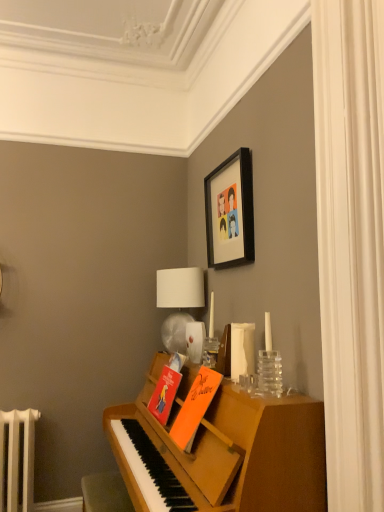
Question: From a real-world perspective, is white fabric lampshade at upper center below matte orange book at center, which is the second book in front-to-back order?

Choices:
 (A) yes
 (B) no

Answer: (B)

Question: Does white fabric lampshade at upper center have a smaller size compared to matte orange book at center, which is the second book in front-to-back order?

Choices:
 (A) yes
 (B) no

Answer: (B)

Question: Does white fabric lampshade at upper center have a lesser height compared to matte orange book at center, which is the second book in front-to-back order?

Choices:
 (A) no
 (B) yes

Answer: (A)

Question: Is white fabric lampshade at upper center not near matte orange book at center, acting as the first book starting from the back?

Choices:
 (A) no
 (B) yes

Answer: (A)

Question: Are white fabric lampshade at upper center and matte orange book at center, which is the second book in front-to-back order, making contact?

Choices:
 (A) yes
 (B) no

Answer: (B)

Question: From the image's perspective, would you say white fabric lampshade at upper center is shown under matte orange book at center, acting as the first book starting from the back?

Choices:
 (A) yes
 (B) no

Answer: (B)

Question: Is the depth of orange matte book at center, the 1th book from the front, greater than that of white fabric lampshade at upper center?

Choices:
 (A) yes
 (B) no

Answer: (B)

Question: Is orange matte book at center, the 1th book from the front, not inside white fabric lampshade at upper center?

Choices:
 (A) yes
 (B) no

Answer: (A)

Question: Does orange matte book at center, the 2th book when ordered from back to front, have a lesser height compared to white fabric lampshade at upper center?

Choices:
 (A) no
 (B) yes

Answer: (B)

Question: Would you say orange matte book at center, the 1th book from the front, contains white fabric lampshade at upper center?

Choices:
 (A) no
 (B) yes

Answer: (A)

Question: Does orange matte book at center, the 1th book from the front, have a larger size compared to white fabric lampshade at upper center?

Choices:
 (A) yes
 (B) no

Answer: (B)

Question: Can you confirm if orange matte book at center, the 2th book when ordered from back to front, is wider than white fabric lampshade at upper center?

Choices:
 (A) yes
 (B) no

Answer: (A)

Question: Is white fabric lampshade at upper center to the right of clear glass vase at right from the viewer's perspective?

Choices:
 (A) no
 (B) yes

Answer: (A)